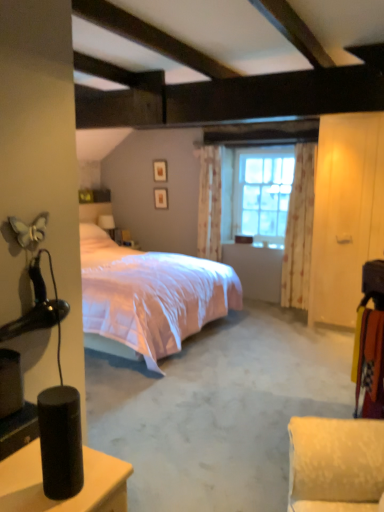
Question: From a real-world perspective, is pink satin bed at center over matte wooden picture frame at upper center, placed as the 1th picture frame when sorted from top to bottom?

Choices:
 (A) no
 (B) yes

Answer: (A)

Question: Is pink satin bed at center oriented away from matte wooden picture frame at upper center, the second picture frame positioned from the bottom?

Choices:
 (A) no
 (B) yes

Answer: (A)

Question: Would you say pink satin bed at center is outside matte wooden picture frame at upper center, the second picture frame positioned from the bottom?

Choices:
 (A) no
 (B) yes

Answer: (B)

Question: From the image's perspective, does pink satin bed at center appear higher than matte wooden picture frame at upper center, placed as the 1th picture frame when sorted from top to bottom?

Choices:
 (A) no
 (B) yes

Answer: (A)

Question: Considering the relative positions of pink satin bed at center and matte wooden picture frame at upper center, placed as the 1th picture frame when sorted from top to bottom, in the image provided, is pink satin bed at center in front of matte wooden picture frame at upper center, placed as the 1th picture frame when sorted from top to bottom,?

Choices:
 (A) no
 (B) yes

Answer: (B)

Question: Does pink satin bed at center have a lesser height compared to matte wooden picture frame at upper center, the second picture frame positioned from the bottom?

Choices:
 (A) no
 (B) yes

Answer: (A)

Question: From the image's perspective, does pink satin bed at center appear higher than floral fabric curtain at right, which ranks as the second curtain in back-to-front order?

Choices:
 (A) no
 (B) yes

Answer: (A)

Question: Could you tell me if pink satin bed at center is facing floral fabric curtain at right, the 2th curtain when ordered from left to right?

Choices:
 (A) yes
 (B) no

Answer: (B)

Question: Is pink satin bed at center far from floral fabric curtain at right, which ranks as the second curtain in back-to-front order?

Choices:
 (A) no
 (B) yes

Answer: (B)

Question: Is pink satin bed at center further to the viewer compared to floral fabric curtain at right, which ranks as the first curtain in right-to-left order?

Choices:
 (A) yes
 (B) no

Answer: (B)

Question: From a real-world perspective, is pink satin bed at center on top of floral fabric curtain at right, the 2th curtain when ordered from left to right?

Choices:
 (A) no
 (B) yes

Answer: (A)

Question: Is the depth of pink satin bed at center less than that of floral fabric curtain at right, which ranks as the second curtain in back-to-front order?

Choices:
 (A) no
 (B) yes

Answer: (B)

Question: Is floral fabric curtain at right, which ranks as the second curtain in back-to-front order, closer to the viewer compared to matte wooden picture frame at upper center, the second picture frame positioned from the bottom?

Choices:
 (A) yes
 (B) no

Answer: (A)